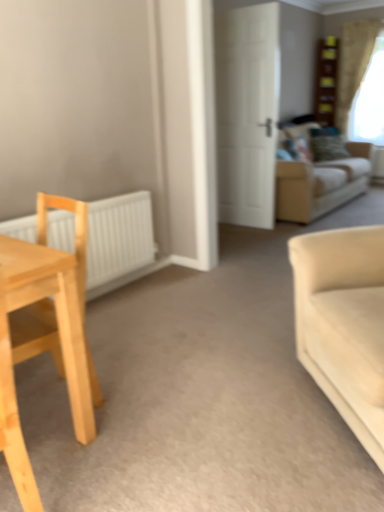
Describe the element at coordinates (353, 64) in the screenshot. I see `white sheer curtain at upper right` at that location.

Image resolution: width=384 pixels, height=512 pixels. What are the coordinates of `white matte door at center` in the screenshot? It's located at (247, 112).

This screenshot has width=384, height=512. What do you see at coordinates (327, 144) in the screenshot?
I see `green textured pillow at upper right` at bounding box center [327, 144].

Image resolution: width=384 pixels, height=512 pixels. I want to click on white matte radiator at left, so click(118, 237).

The image size is (384, 512). Describe the element at coordinates (118, 237) in the screenshot. I see `white matte radiator at left` at that location.

Locate an element on the screen. The image size is (384, 512). white sheer curtain at upper right is located at coordinates (x=353, y=64).

Are white matte door at center and light wood chair at left far apart?

Absolutely, white matte door at center is distant from light wood chair at left.

Looking at their sizes, would you say white matte door at center is wider or thinner than light wood chair at left?

white matte door at center is thinner than light wood chair at left.

Is point (237, 143) closer or farther from the camera than point (56, 362)?

Point (237, 143) is positioned farther from the camera compared to point (56, 362).

Is light wood chair at left surrounded by white matte door at center?

No.

How many degrees apart are the facing directions of white matte radiator at left and beige fabric couch at upper right, arranged as the 1th studio couch when viewed from the back?

The angular difference between white matte radiator at left and beige fabric couch at upper right, arranged as the 1th studio couch when viewed from the back, is 0.305 degrees.

In the image, is white matte radiator at left on the left side or the right side of beige fabric couch at upper right, the second studio couch viewed from the front?

Clearly, white matte radiator at left is on the left of beige fabric couch at upper right, the second studio couch viewed from the front, in the image.

From a real-world perspective, is white matte radiator at left located beneath beige fabric couch at upper right, arranged as the 1th studio couch when viewed from the back?

Yes, from a real-world perspective, white matte radiator at left is below beige fabric couch at upper right, arranged as the 1th studio couch when viewed from the back.

Are beige fabric couch at upper right, the first studio couch from the top, and white matte radiator at left making contact?

No, beige fabric couch at upper right, the first studio couch from the top, is not touching white matte radiator at left.

Does point (285, 211) come in front of point (88, 265)?

No, it is not.

Identify the location of studio couch above the white matte radiator at left (from the image's perspective). This screenshot has width=384, height=512. (321, 184).

Is light wood chair at left smaller than beige fabric couch at upper right, the first studio couch from the top?

Yes, light wood chair at left is smaller than beige fabric couch at upper right, the first studio couch from the top.

Find the location of `chair below the beige fabric couch at upper right, the first studio couch from the top (from a real-world perspective)`. chair below the beige fabric couch at upper right, the first studio couch from the top (from a real-world perspective) is located at coordinates (44, 332).

From a real-world perspective, relative to beige fabric couch at upper right, arranged as the second studio couch when ordered from the bottom, is light wood chair at left vertically above or below?

From a real-world perspective, light wood chair at left is physically below beige fabric couch at upper right, arranged as the second studio couch when ordered from the bottom.

Based on the photo, which object is more forward, light wood chair at left or beige fabric couch at upper right, arranged as the 1th studio couch when viewed from the back?

light wood chair at left.

Locate an element on the screen. This screenshot has width=384, height=512. studio couch lying in front of the beige fabric couch at upper right, the first studio couch from the top is located at coordinates (344, 323).

Is beige fabric couch at upper right, arranged as the 1th studio couch when viewed from the back, wider than beige fabric couch at right, which is counted as the second studio couch, starting from the back?

Indeed, beige fabric couch at upper right, arranged as the 1th studio couch when viewed from the back, has a greater width compared to beige fabric couch at right, which is counted as the second studio couch, starting from the back.

Consider the image. From a real-world perspective, is beige fabric couch at upper right, arranged as the 1th studio couch when viewed from the back, physically above beige fabric couch at right, the 1th studio couch positioned from the front?

Correct, in the physical world, beige fabric couch at upper right, arranged as the 1th studio couch when viewed from the back, is higher than beige fabric couch at right, the 1th studio couch positioned from the front.

Between beige fabric couch at upper right, the second studio couch viewed from the front, and beige fabric couch at right, the 2th studio couch viewed from the top, which one appears on the left side from the viewer's perspective?

Positioned to the left is beige fabric couch at right, the 2th studio couch viewed from the top.

From a real-world perspective, is green textured pillow at upper right below white matte door at center?

Indeed, from a real-world perspective, green textured pillow at upper right is positioned beneath white matte door at center.

Is white matte door at center surrounded by green textured pillow at upper right?

No, white matte door at center is not surrounded by green textured pillow at upper right.

Does point (313, 149) come in front of point (259, 90)?

That is False.

Is green textured pillow at upper right oriented towards white matte door at center?

No, green textured pillow at upper right does not turn towards white matte door at center.

The width and height of the screenshot is (384, 512). What are the coordinates of `pillow positioned vertically above the white matte radiator at left (from a real-world perspective)` in the screenshot? It's located at (327, 144).

From a real-world perspective, who is located lower, green textured pillow at upper right or white matte radiator at left?

In real-world perspective, white matte radiator at left is lower.

Consider the image. Are green textured pillow at upper right and white matte radiator at left making contact?

No, green textured pillow at upper right is not in contact with white matte radiator at left.

Would you say white matte radiator at left is part of green textured pillow at upper right's contents?

No, white matte radiator at left is not surrounded by green textured pillow at upper right.

The height and width of the screenshot is (512, 384). What are the coordinates of `door above the light wood chair at left (from the image's perspective)` in the screenshot? It's located at (247, 112).

Find the location of `studio couch behind the white matte radiator at left`. studio couch behind the white matte radiator at left is located at coordinates click(321, 184).

Considering their positions, is white matte door at center positioned closer to white matte radiator at left than white sheer curtain at upper right?

Among the two, white matte door at center is located nearer to white matte radiator at left.

Which object lies further to the anchor point beige fabric couch at upper right, arranged as the 1th studio couch when viewed from the back, light wood chair at left or white sheer curtain at upper right?

The object further to beige fabric couch at upper right, arranged as the 1th studio couch when viewed from the back, is light wood chair at left.

Considering their positions, is white sheer curtain at upper right positioned further to beige fabric couch at upper right, arranged as the 1th studio couch when viewed from the back, than green textured pillow at upper right?

The object further to beige fabric couch at upper right, arranged as the 1th studio couch when viewed from the back, is white sheer curtain at upper right.

Consider the image. When comparing their distances from green textured pillow at upper right, does beige fabric couch at right, which is counted as the second studio couch, starting from the back, or light wood chair at left seem further?

light wood chair at left lies further to green textured pillow at upper right than the other object.

When comparing their distances from green textured pillow at upper right, does white sheer curtain at upper right or beige fabric couch at upper right, the second studio couch viewed from the front, seem closer?

Result: The object closer to green textured pillow at upper right is beige fabric couch at upper right, the second studio couch viewed from the front.

Looking at the image, which one is located closer to beige fabric couch at right, the 2th studio couch viewed from the top, white sheer curtain at upper right or beige fabric couch at upper right, arranged as the 1th studio couch when viewed from the back?

beige fabric couch at upper right, arranged as the 1th studio couch when viewed from the back, is closer to beige fabric couch at right, the 2th studio couch viewed from the top.

Based on their spatial positions, is beige fabric couch at upper right, arranged as the 1th studio couch when viewed from the back, or beige fabric couch at right, the 1th studio couch positioned from the front, closer to white matte radiator at left?

The object closer to white matte radiator at left is beige fabric couch at right, the 1th studio couch positioned from the front.

Which object lies nearer to the anchor point beige fabric couch at upper right, the second studio couch viewed from the front, white sheer curtain at upper right or beige fabric couch at right, which is counted as the second studio couch, starting from the back?

The object closer to beige fabric couch at upper right, the second studio couch viewed from the front, is white sheer curtain at upper right.

The image size is (384, 512). What are the coordinates of `studio couch between light wood chair at left and green textured pillow at upper right from front to back` in the screenshot? It's located at (321, 184).

You are a GUI agent. You are given a task and a screenshot of the screen. Output one action in this format:
    pyautogui.click(x=<x>, y=<y>)
    Task: Click on the pillow positioned between light wood chair at left and white sheer curtain at upper right from near to far
    
    Given the screenshot: What is the action you would take?
    pyautogui.click(x=327, y=144)

You are a GUI agent. You are given a task and a screenshot of the screen. Output one action in this format:
    pyautogui.click(x=<x>, y=<y>)
    Task: Click on the door positioned between light wood chair at left and green textured pillow at upper right from near to far
    The width and height of the screenshot is (384, 512).
    Given the screenshot: What is the action you would take?
    pyautogui.click(x=247, y=112)

Find the location of a particular element. This screenshot has width=384, height=512. door located between light wood chair at left and white sheer curtain at upper right in the depth direction is located at coordinates (247, 112).